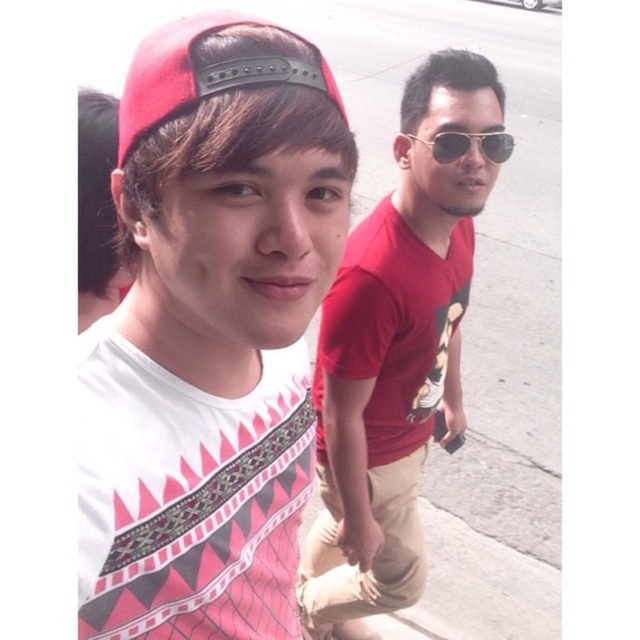
You are a photographer setting up a camera at the lower right corner of the scene. You want to ensure both the matte pink cap at upper left and the matte red baseball cap at upper left are fully visible in your shot. Which cap might block the view of the other due to its height?

The matte pink cap at upper left is taller than the matte red baseball cap at upper left, so it might block the view of the matte red baseball cap at upper left.

You are a photographer trying to capture a candid shot of the sunglasses at center without the matte pink cap at upper left appearing in the frame. Is this possible given their positions?

The matte pink cap at upper left is to the left of the sunglasses at center, so if you position yourself to the right side of the scene, you can frame the shot to exclude the matte pink cap at upper left while capturing the sunglasses at center.